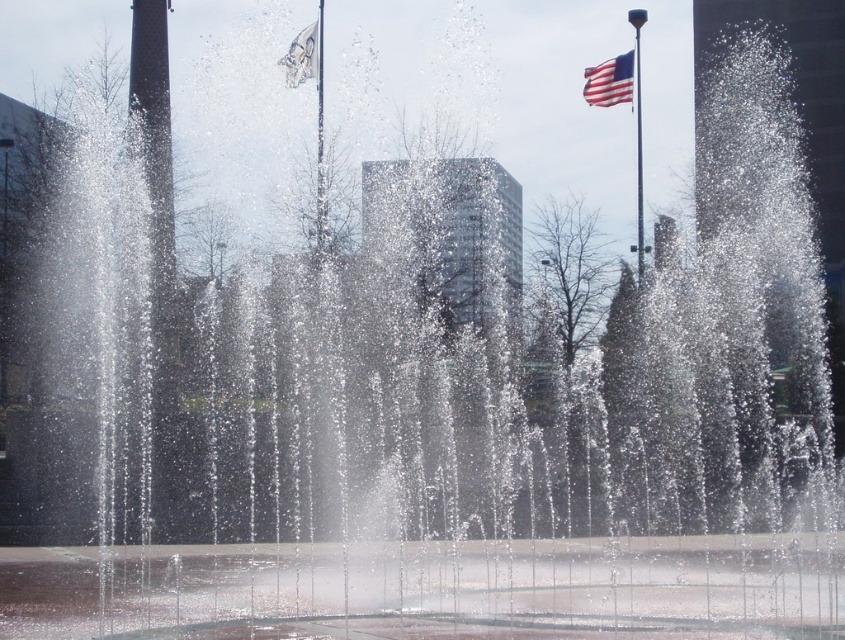
You are a photographer trying to capture a photo of the fountain and the flags. You notice two flag poles in the scene. Based on their positions, which flag pole, the metallic flag pole at center or the polished metal flag pole at upper right, is closer to the camera?

→ The polished metal flag pole at upper right is closer to the camera because the metallic flag pole at center is positioned above it, indicating it is further back in the scene.

You are a photographer trying to capture both the metallic flag pole at center and the polished metal flag pole at upper right in a single shot. Based on their thickness, which one might require a wider aperture setting to ensure both are in focus?

The metallic flag pole at center is thinner than the polished metal flag pole at upper right, so the wider aperture might be needed for the thicker polished metal flag pole at upper right to ensure both are in focus.

You are a photographer trying to capture both the american flag at upper right and the white fabric flag at upper center in a single shot. Based on their sizes in the image, which flag would appear smaller in the final photo?

The american flag at upper right occupies less space than the white fabric flag at upper center, so it would appear smaller in the final photo.